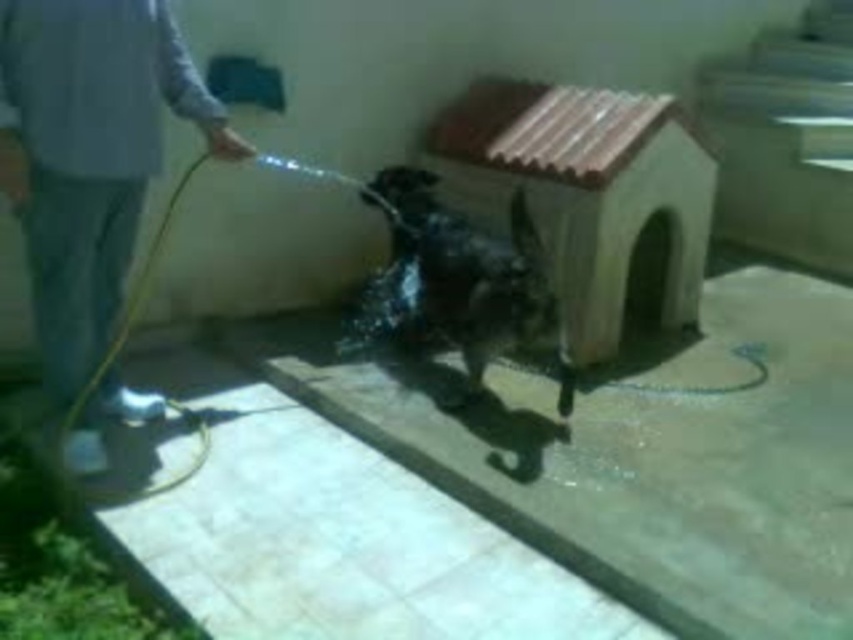
You are a dog trainer observing the scene. The gray fabric pants at lower left and the wet fur dog at center are both in your view. Which object is covering part of the other?

The gray fabric pants at lower left is positioned over wet fur dog at center, so the gray fabric pants at lower left is covering part of the wet fur dog at center.

You are standing in the scene and see the point at coordinates (x=88, y=156). What object is this point located on?

The point at coordinates (x=88, y=156) is located on the gray fabric pants at lower left.

Looking at this image, you are a photographer standing at the camera position. You want to take a closeup photo of the wet fur dog at center. Considering the distance, can you get a clear closeup without moving closer?

The wet fur dog at center is 3.63 meters away from the camera. A standard camera lens can focus on subjects at this distance, so you can take a clear closeup without moving closer.